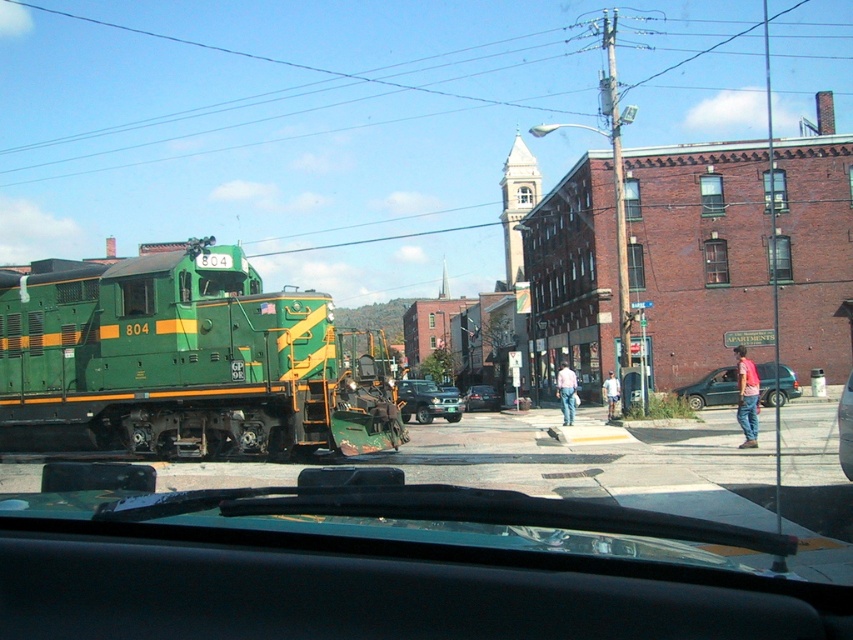
Can you confirm if metallic gray van at right is smaller than metallic silver sedan at center?

No.

Measure the distance between metallic gray van at right and camera.

The distance of metallic gray van at right from camera is 93.57 feet.

Between point (781, 380) and point (467, 401), which one is positioned behind?

The point (467, 401) is more distant.

You are a GUI agent. You are given a task and a screenshot of the screen. Output one action in this format:
    pyautogui.click(x=<x>, y=<y>)
    Task: Click on the metallic gray van at right
    This screenshot has width=853, height=640.
    Given the screenshot: What is the action you would take?
    pyautogui.click(x=711, y=388)

Which is above, green matte train at left or green matte truck at center?

green matte train at left is higher up.

Can you confirm if green matte train at left is positioned to the right of green matte truck at center?

In fact, green matte train at left is to the left of green matte truck at center.

Is point (318, 385) in front of point (438, 385)?

Yes.

The width and height of the screenshot is (853, 640). I want to click on green matte train at left, so click(x=181, y=362).

Between green matte train at left and metallic gray van at right, which one is positioned lower?

metallic gray van at right is below.

Is point (340, 406) farther from camera compared to point (688, 394)?

That is False.

What do you see at coordinates (181, 362) in the screenshot? The width and height of the screenshot is (853, 640). I see `green matte train at left` at bounding box center [181, 362].

This screenshot has height=640, width=853. I want to click on green matte train at left, so click(181, 362).